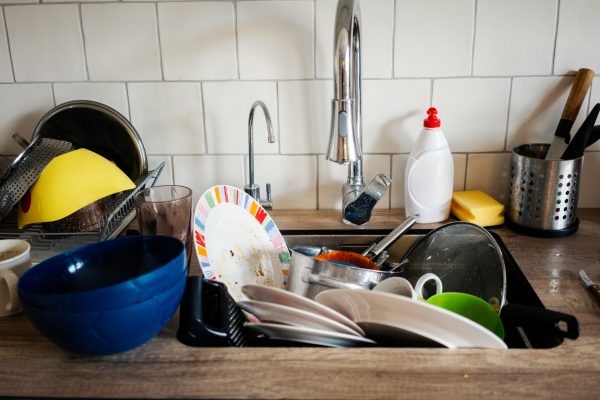
The width and height of the screenshot is (600, 400). What are the coordinates of `plate` in the screenshot? It's located at (306, 338), (303, 320), (306, 307), (383, 309), (244, 246).